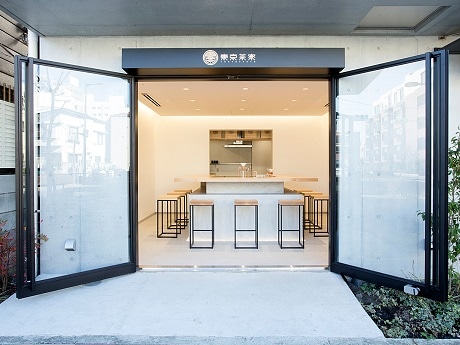
Find the location of a particular element. This screenshot has height=345, width=460. stone floor is located at coordinates (179, 325).